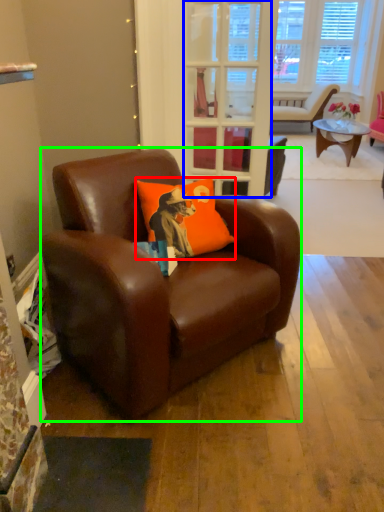
Question: Estimate the real-world distances between objects in this image. Which object is closer to pillow (highlighted by a red box), glass door (highlighted by a blue box) or chair (highlighted by a green box)?

Choices:
 (A) glass door
 (B) chair

Answer: (B)